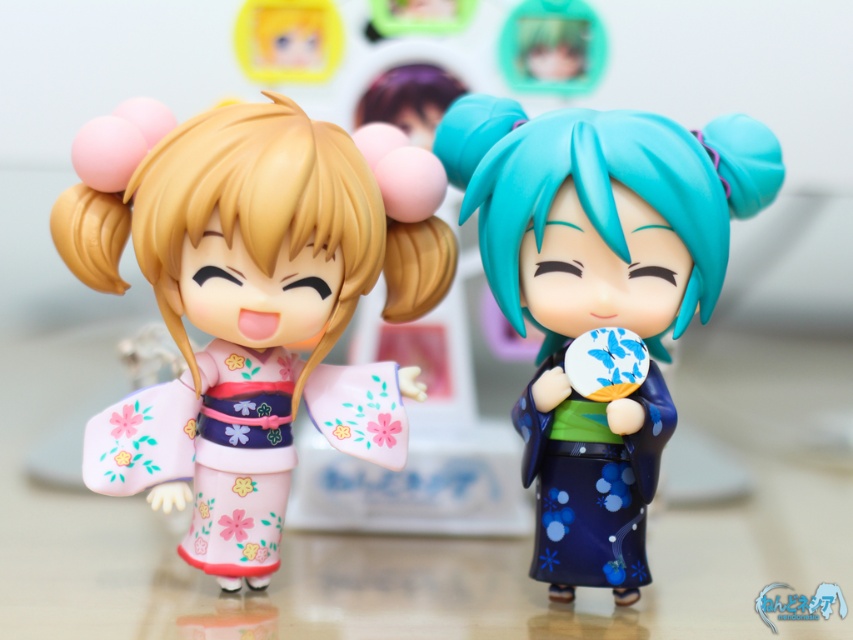
Question: Does pink matte kimono at left appear over blue glossy kimono at center?

Choices:
 (A) no
 (B) yes

Answer: (B)

Question: From the image, what is the correct spatial relationship of pink matte kimono at left in relation to blue glossy kimono at center?

Choices:
 (A) below
 (B) above

Answer: (B)

Question: Does pink matte kimono at left have a greater width compared to blue glossy kimono at center?

Choices:
 (A) no
 (B) yes

Answer: (B)

Question: Which object appears farthest from the camera in this image?

Choices:
 (A) pink matte kimono at left
 (B) blue glossy kimono at center

Answer: (B)